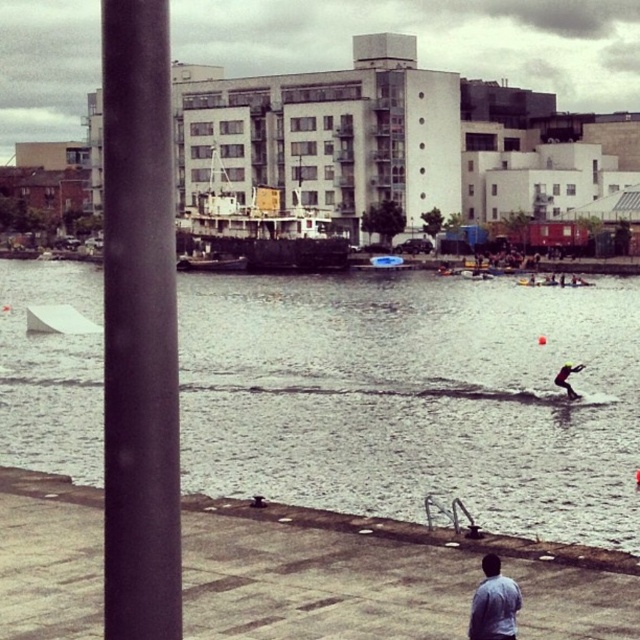
You are a photographer trying to capture the light blue shirt at lower center and the blue plastic boat at center in the same frame. Which object should you focus on first to ensure both are in focus?

The light blue shirt at lower center is thinner than the blue plastic boat at center, so you should focus on the blue plastic boat at center first since it is larger and more likely to be in focus when using depth of field techniques.

You are standing on the dock and see the light blue shirt at lower center and the blue plastic boat at center. Which object is closer to the water surface?

The light blue shirt at lower center is below the blue plastic boat at center, so it is closer to the water surface.

You are a lifeguard on duty at the waterfront. You notice a swimmer in a light blue shirt at lower center and a metallic gray boat at center. The boat is moving towards the swimmer. If the boat is traveling at 10 meters per second, how many seconds will it take for the boat to reach the swimmer?

The distance between the light blue shirt at lower center and the metallic gray boat at center is 128.25 meters. At a speed of 10 meters per second, the boat will take 12.825 seconds to reach the swimmer.